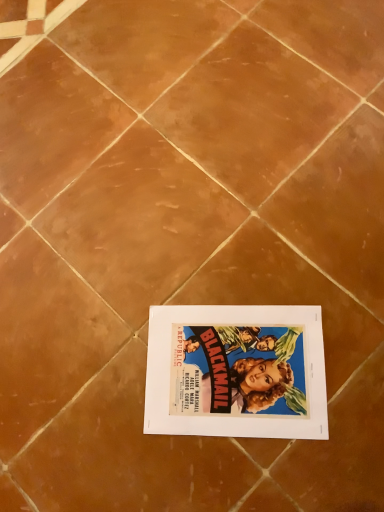
The image size is (384, 512). I want to click on vacant area located to the right-hand side of white paper at center, so click(329, 298).